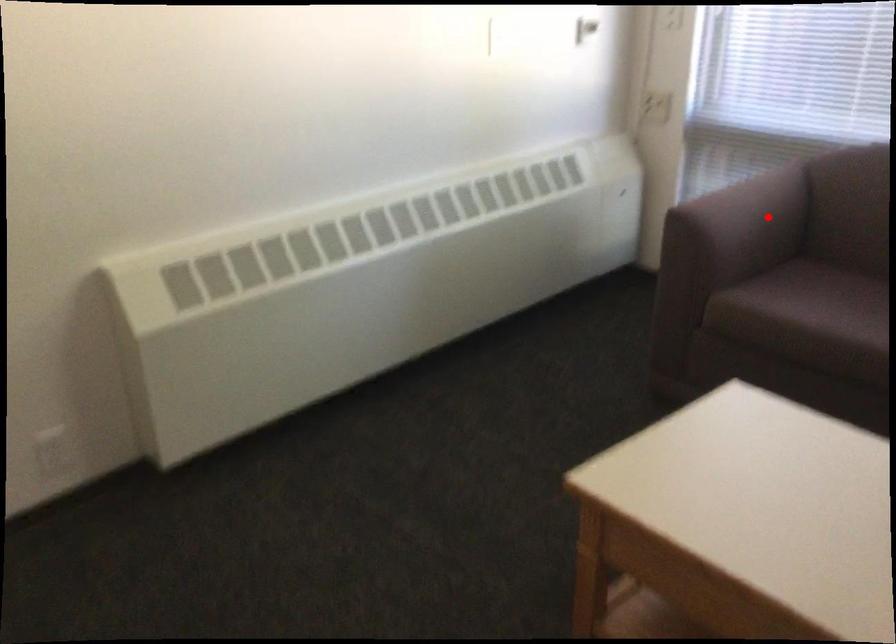
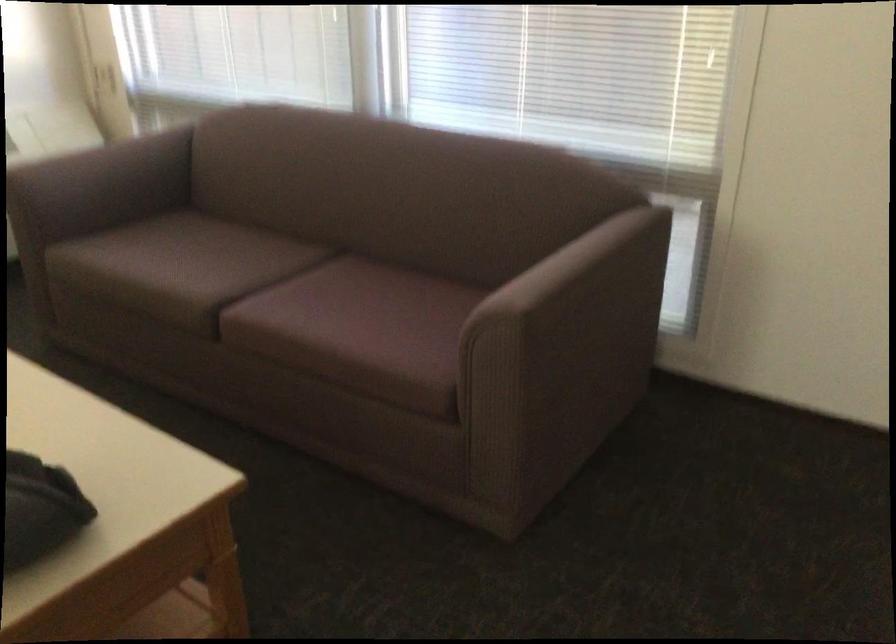
The point at the highlighted location is marked in the first image. Where is the corresponding point in the second image?

(113, 173)